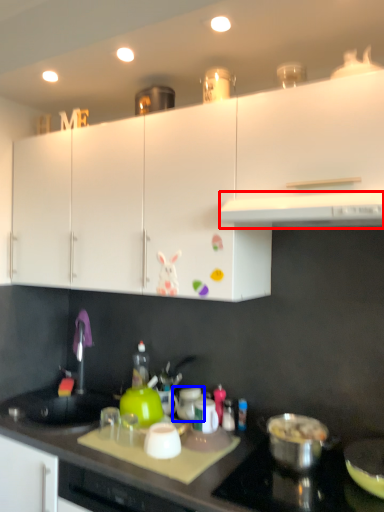
Question: Which object is closer to the camera taking this photo, exhaust hood (highlighted by a red box) or appliance (highlighted by a blue box)?

Choices:
 (A) exhaust hood
 (B) appliance

Answer: (A)